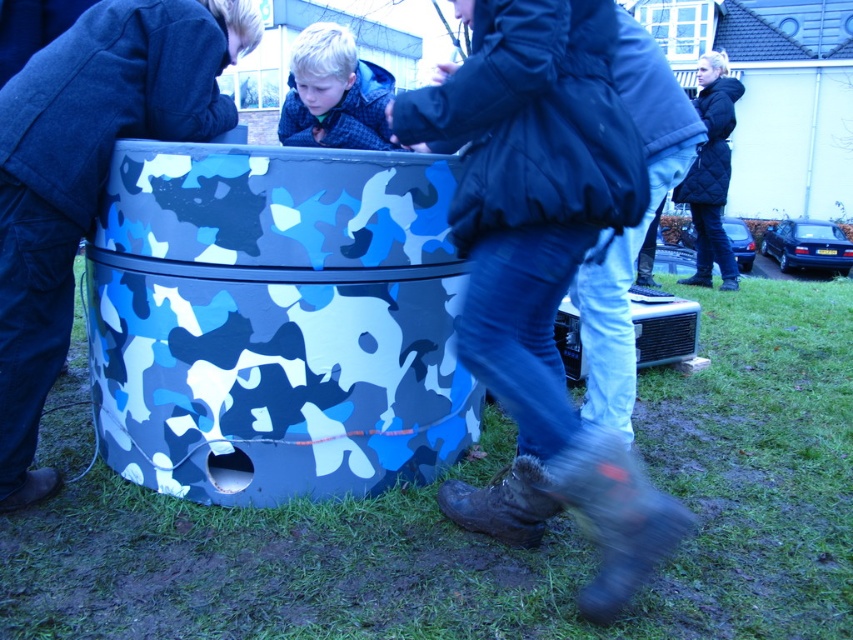
Is point (548, 353) farther from camera compared to point (277, 125)?

No.

Between point (672, 544) and point (352, 106), which one is positioned in front?

Point (672, 544) is more forward.

Which is in front, point (555, 26) or point (320, 141)?

Point (555, 26) is in front.

At what (x,y) coordinates should I click in order to perform the action: click on dark blue puffy jacket at center. Please return your answer as a coordinate pair (x, y). Looking at the image, I should click on (543, 268).

Which is above, dark blue puffy jacket at center or quilted black jacket at upper right?

Positioned higher is quilted black jacket at upper right.

You are a GUI agent. You are given a task and a screenshot of the screen. Output one action in this format:
    pyautogui.click(x=<x>, y=<y>)
    Task: Click on the dark blue puffy jacket at center
    The height and width of the screenshot is (640, 853).
    Given the screenshot: What is the action you would take?
    pyautogui.click(x=543, y=268)

At what (x,y) coordinates should I click in order to perform the action: click on dark blue puffy jacket at center. Please return your answer as a coordinate pair (x, y). This screenshot has width=853, height=640. Looking at the image, I should click on (543, 268).

Which is more to the left, blonde hair at center or quilted black jacket at upper right?

Positioned to the left is blonde hair at center.

Is blonde hair at center shorter than quilted black jacket at upper right?

Yes, blonde hair at center is shorter than quilted black jacket at upper right.

Is point (328, 125) in front of point (682, 198)?

Yes, point (328, 125) is closer to viewer.

Where is `blonde hair at center`? blonde hair at center is located at coordinates (334, 93).